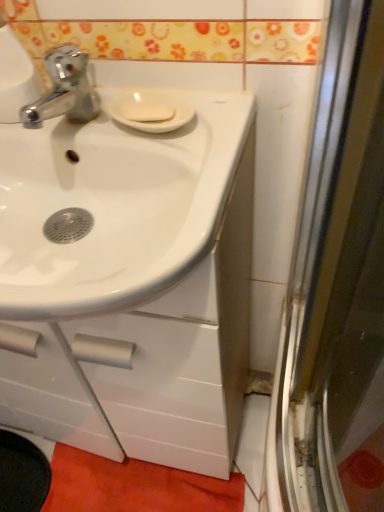
At what (x,y) coordinates should I click in order to perform the action: click on vacant space that is to the left of white matte soap at center. Please return your answer as a coordinate pair (x, y). The width and height of the screenshot is (384, 512). Looking at the image, I should click on [x=75, y=119].